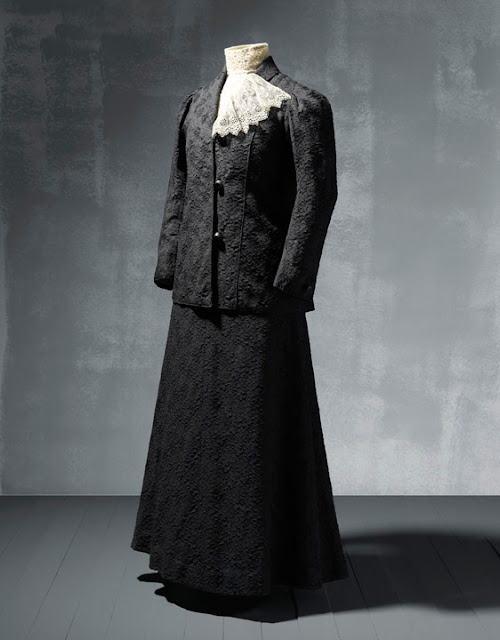
The height and width of the screenshot is (640, 500). Identify the location of creases between boards on floor. (55, 569), (70, 619), (261, 626), (297, 616), (335, 617), (367, 601), (456, 577), (494, 545).